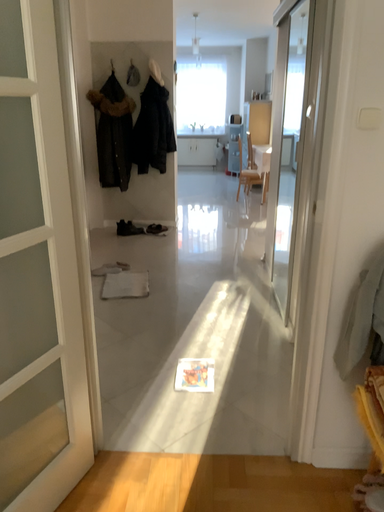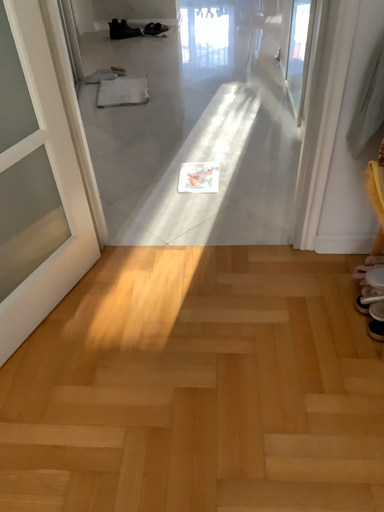
Question: Which way did the camera rotate in the video?

Choices:
 (A) rotated upward
 (B) rotated downward

Answer: (B)